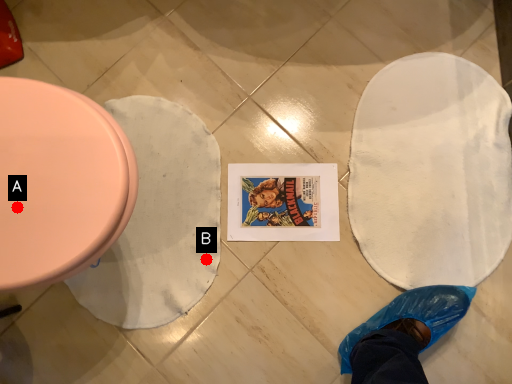
Question: Two points are circled on the image, labeled by A and B beside each circle. Which point is closer to the camera?

Choices:
 (A) A is closer
 (B) B is closer

Answer: (A)